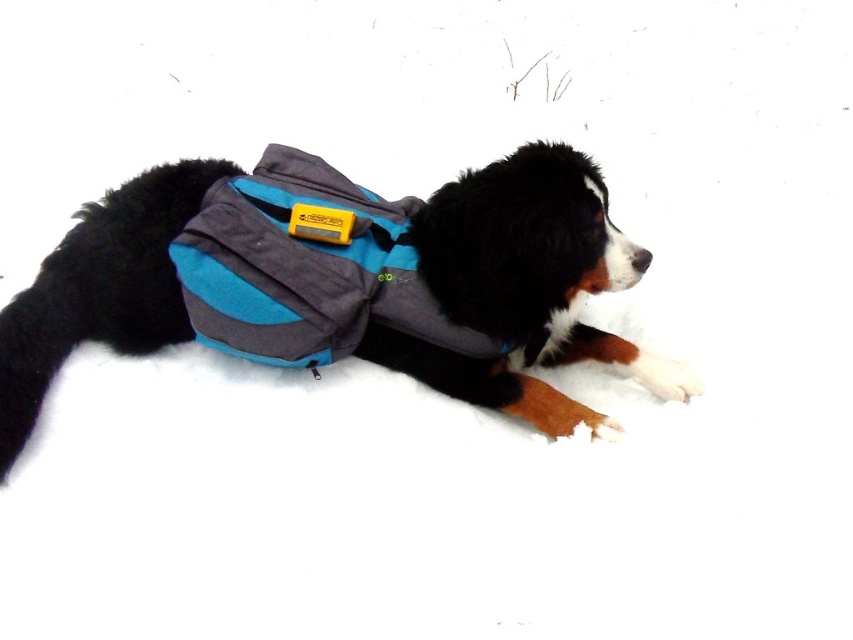
You are a hiker trying to navigate through the snowy area. You see two points marked on your map. The first point is at coordinate point (x=6, y=436) and the second point is at coordinate point (x=350, y=243). According to the scene, which point is closer to you?

Point (x=6, y=436) is in front of point (x=350, y=243), so the first point is closer to you.

You are a hiker who needs to take a photo of the soft gray fabric dog vest at center. Your camera is placed somewhere in the scene. Can you reach the camera from where you are standing to take the photo without moving more than 8 feet?

The soft gray fabric dog vest at center and camera are 8.46 feet apart. Since 8.46 feet is slightly more than 8 feet, you cannot reach the camera within the 8 feet limit without moving further.

You are a hiker trying to locate the soft gray fabric dog vest at center in the snowy scene. Based on the coordinates provided, where exactly would you find it?

The soft gray fabric dog vest at center is located at point coordinates 0.450 on the x axis and 0.615 on the y axis.